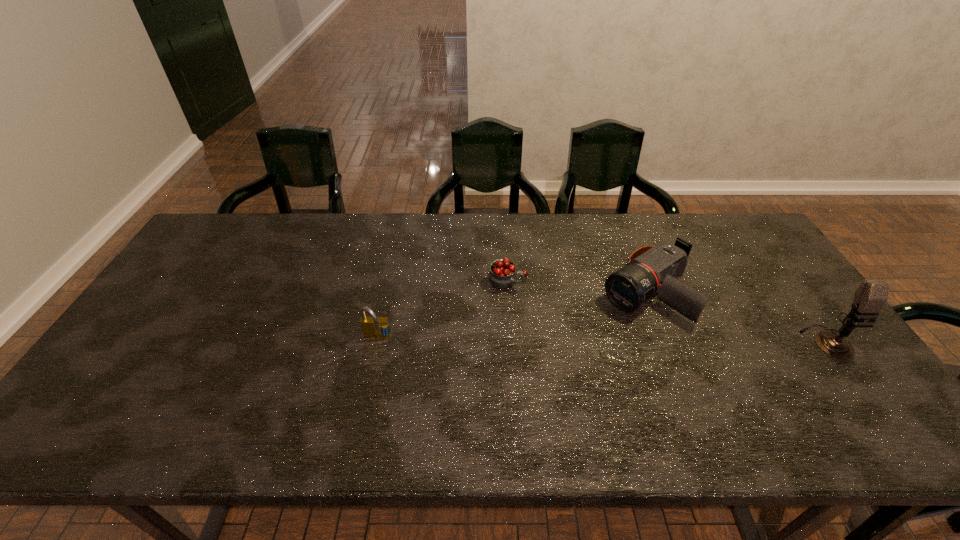
Find the location of a particular element. free space on the desktop that is between the leftmost object and the microphone and is positioned on the handle side of the pot filled with cherries is located at coordinates (647, 340).

You are a GUI agent. You are given a task and a screenshot of the screen. Output one action in this format:
    pyautogui.click(x=<x>, y=<y>)
    Task: Click on the vacant space on the desktop that is between the padlock and the tallest object and is positioned on the lens of the second object from right to left
    This screenshot has width=960, height=540.
    Given the screenshot: What is the action you would take?
    pyautogui.click(x=580, y=339)